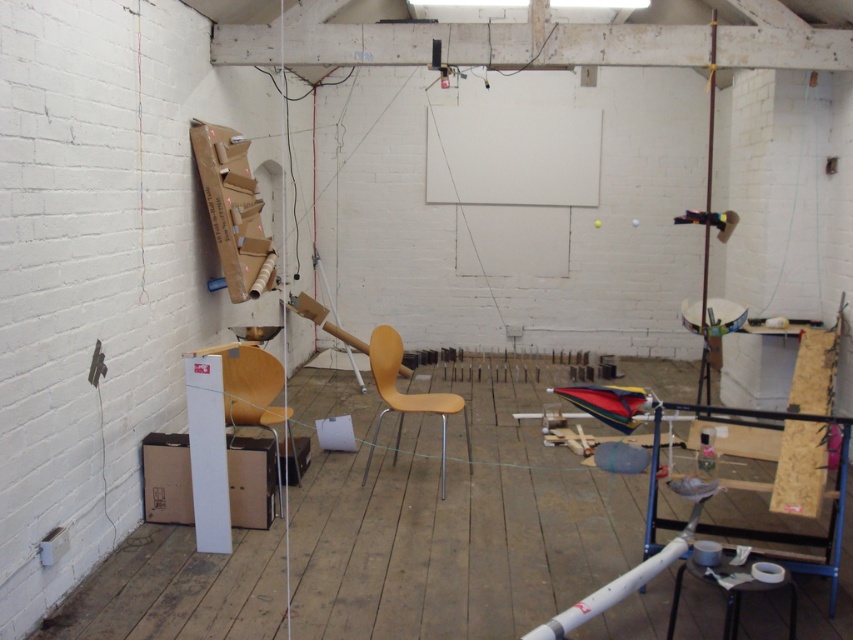
Question: In this image, where is white painted wood beam at upper center located relative to wooden pole at right?

Choices:
 (A) right
 (B) left

Answer: (B)

Question: Does white painted wood beam at upper center appear under cardboard box at lower left?

Choices:
 (A) no
 (B) yes

Answer: (A)

Question: Which of the following is the farthest from the observer?

Choices:
 (A) black plastic stool at lower right
 (B) white painted wood beam at upper center

Answer: (B)

Question: Can you confirm if white painted wood beam at upper center is bigger than black plastic stool at lower right?

Choices:
 (A) no
 (B) yes

Answer: (B)

Question: Based on their relative distances, which object is farther from the black plastic stool at lower right?

Choices:
 (A) light brown wood chair at center
 (B) cardboard box at lower left
 (C) white painted wood beam at upper center
 (D) wooden pole at right

Answer: (D)

Question: Based on their relative distances, which object is farther from the black plastic stool at lower right?

Choices:
 (A) cardboard box at lower left
 (B) wooden pole at right
 (C) light brown wood chair at center

Answer: (B)